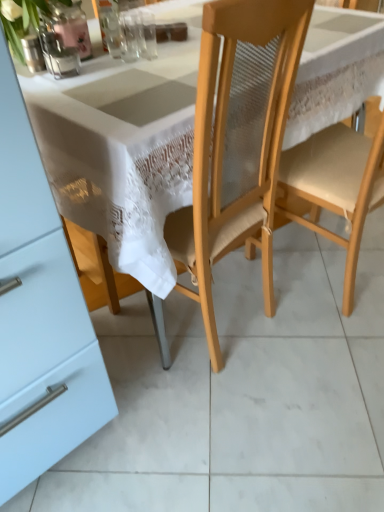
Identify the location of vacant space situated on the left part of transparent glass at upper center, arranged as the first tableware when viewed from the right. (69, 65).